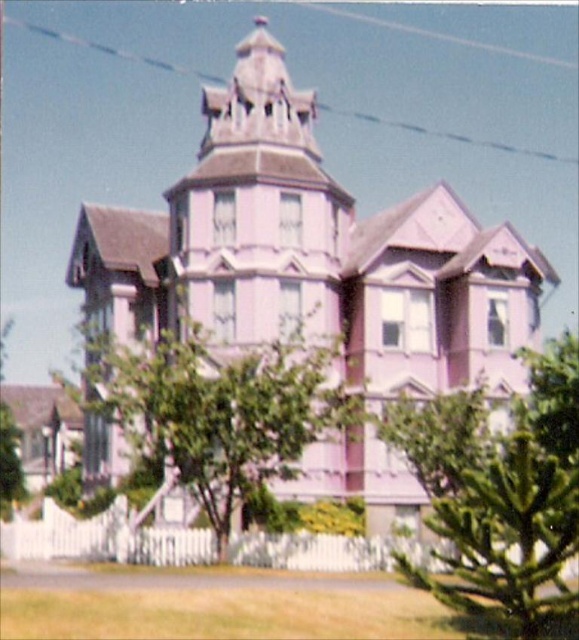
Can you confirm if green textured tree at lower right is taller than green leafy tree at lower left?

Incorrect, green textured tree at lower right's height is not larger of green leafy tree at lower left's.

This screenshot has height=640, width=579. Describe the element at coordinates (507, 541) in the screenshot. I see `green textured tree at lower right` at that location.

Where is `green textured tree at lower right`? green textured tree at lower right is located at coordinates (507, 541).

Between green leafy tree at center and green textured tree at lower right, which one is positioned higher?

green leafy tree at center is above.

Measure the distance between point (118, 392) and camera.

The distance of point (118, 392) from camera is 44.75 meters.

What do you see at coordinates (217, 412) in the screenshot?
I see `green leafy tree at center` at bounding box center [217, 412].

You are a GUI agent. You are given a task and a screenshot of the screen. Output one action in this format:
    pyautogui.click(x=<x>, y=<y>)
    Task: Click on the green leafy tree at center
    The image size is (579, 640).
    Given the screenshot: What is the action you would take?
    pyautogui.click(x=217, y=412)

The height and width of the screenshot is (640, 579). What do you see at coordinates (217, 412) in the screenshot?
I see `green leafy tree at center` at bounding box center [217, 412].

Is green leafy tree at center bigger than green leafy tree at lower left?

Incorrect, green leafy tree at center is not larger than green leafy tree at lower left.

Identify the location of green leafy tree at center. (217, 412).